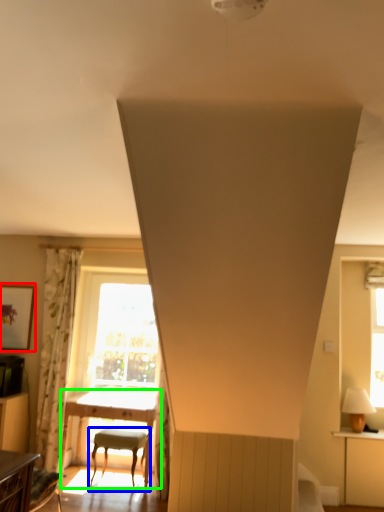
Question: Which is nearer to the picture frame (highlighted by a red box)? chair (highlighted by a blue box) or table (highlighted by a green box).

Choices:
 (A) chair
 (B) table

Answer: (B)